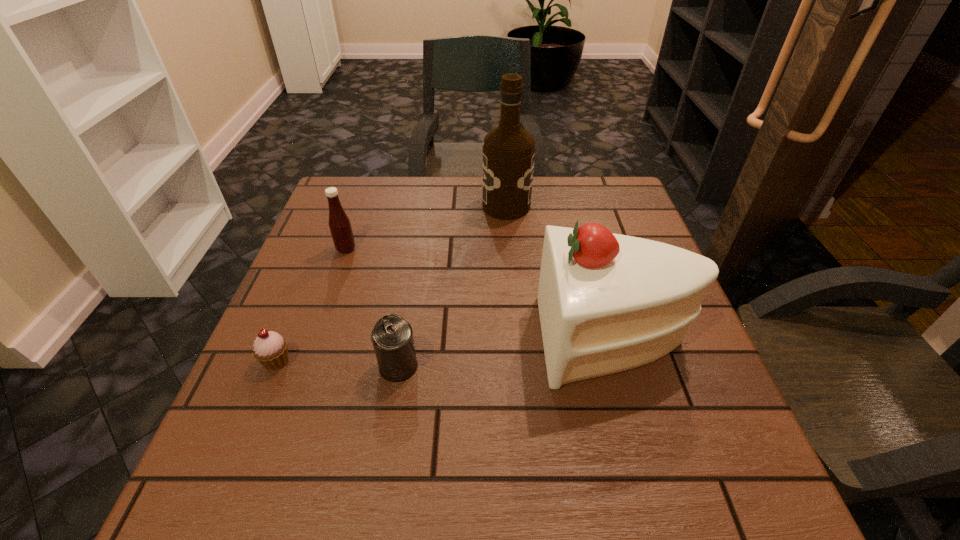
Image resolution: width=960 pixels, height=540 pixels. Find the location of `free space that is in between the cake and the second farthest object`. free space that is in between the cake and the second farthest object is located at coordinates (480, 294).

The width and height of the screenshot is (960, 540). In order to click on free space between the cupcake and the second shortest object in this screenshot , I will do 338,363.

The image size is (960, 540). I want to click on free point between the tallest object and the leftmost object, so click(x=392, y=284).

At what (x,y) coordinates should I click in order to perform the action: click on vacant area that lies between the second object from left to right and the cake. Please return your answer as a coordinate pair (x, y). Looking at the image, I should click on (480, 294).

Select which object is the closest to the can. Please provide its 2D coordinates. Your answer should be formatted as a tuple, i.e. [(x, y)], where the tuple contains the x and y coordinates of a point satisfying the conditions above.

[(270, 348)]

Identify which object is the second closest to the can. Please provide its 2D coordinates. Your answer should be formatted as a tuple, i.e. [(x, y)], where the tuple contains the x and y coordinates of a point satisfying the conditions above.

[(607, 302)]

Locate an element on the screen. Image resolution: width=960 pixels, height=540 pixels. free spot that satisfies the following two spatial constraints: 1. on the label of the alcohol; 2. on the right side of the second tallest object is located at coordinates (516, 339).

The width and height of the screenshot is (960, 540). I want to click on free space that satisfies the following two spatial constraints: 1. on the label of the farthest object; 2. on the front side of the leftmost object, so click(x=518, y=361).